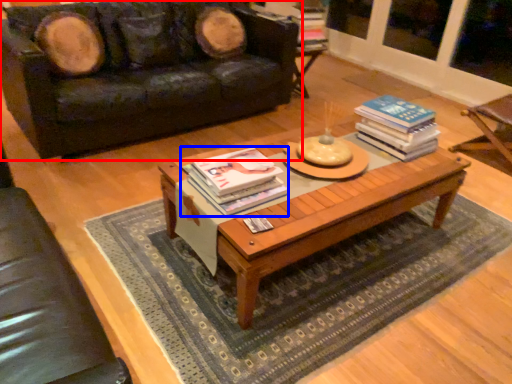
Question: Which point is closer to the camera, studio couch (highlighted by a red box) or book (highlighted by a blue box)?

Choices:
 (A) studio couch
 (B) book

Answer: (B)